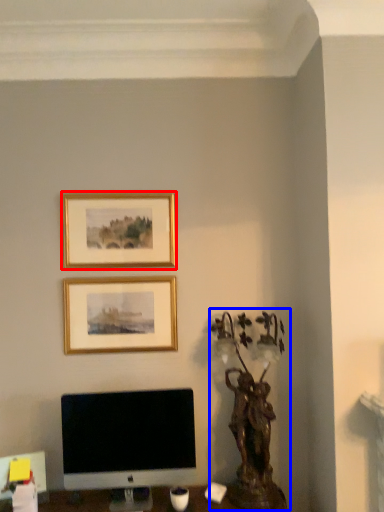
Question: Which point is closer to the camera, picture frame (highlighted by a red box) or bronze statue (highlighted by a blue box)?

Choices:
 (A) picture frame
 (B) bronze statue

Answer: (B)